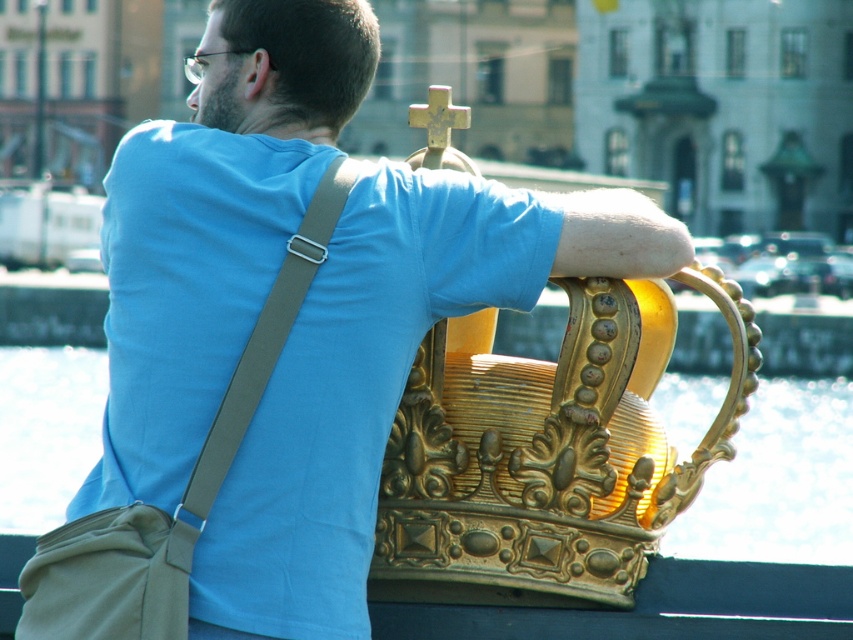
Consider the image. Is gold metallic water at upper center thinner than rusty metal cross at upper center?

Incorrect, gold metallic water at upper center's width is not less than rusty metal cross at upper center's.

At what (x,y) coordinates should I click in order to perform the action: click on gold metallic water at upper center. Please return your answer as a coordinate pair (x, y). Looking at the image, I should click on (778, 481).

This screenshot has width=853, height=640. I want to click on gold metallic water at upper center, so click(778, 481).

Is point (715, 476) farther from viewer compared to point (282, 305)?

Yes.

Can you confirm if gold metallic water at upper center is wider than gray fabric strap at upper left?

Yes, gold metallic water at upper center is wider than gray fabric strap at upper left.

Does point (10, 381) lie behind point (196, 529)?

Yes, it is behind point (196, 529).

At what (x,y) coordinates should I click in order to perform the action: click on gold metallic water at upper center. Please return your answer as a coordinate pair (x, y). Looking at the image, I should click on (778, 481).

Can you confirm if gray fabric strap at upper left is shorter than rusty metal cross at upper center?

Yes, gray fabric strap at upper left is shorter than rusty metal cross at upper center.

Does gray fabric strap at upper left appear over rusty metal cross at upper center?

Incorrect, gray fabric strap at upper left is not positioned above rusty metal cross at upper center.

Is point (204, 468) positioned behind point (448, 106)?

No.

At what (x,y) coordinates should I click in order to perform the action: click on gray fabric strap at upper left. Please return your answer as a coordinate pair (x, y). The width and height of the screenshot is (853, 640). Looking at the image, I should click on (263, 346).